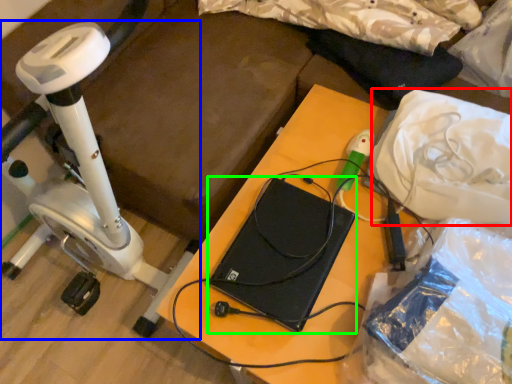
Question: Which object is positioned farthest from material (highlighted by a red box)? Select from stationary bicycle (highlighted by a blue box) and computer (highlighted by a green box).

Choices:
 (A) stationary bicycle
 (B) computer

Answer: (A)